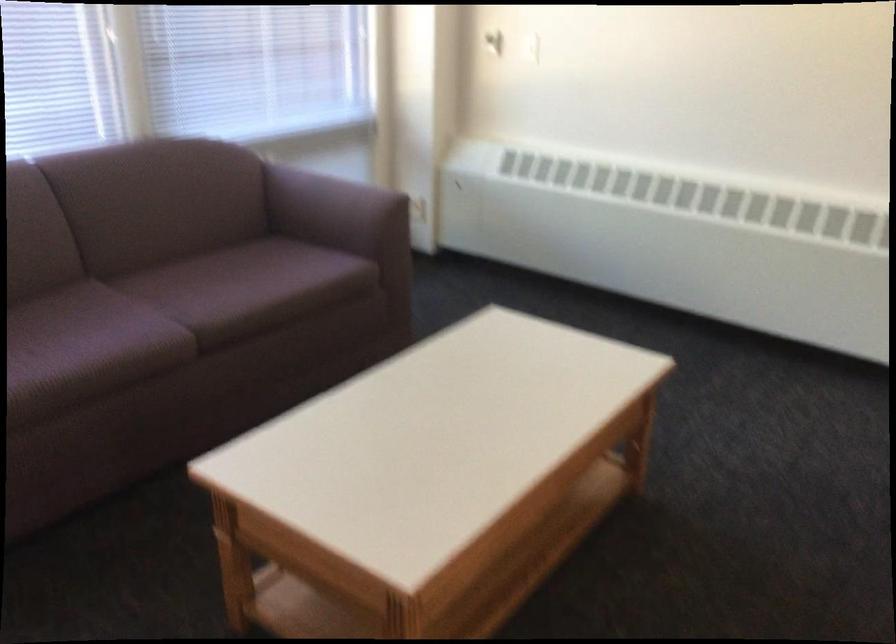
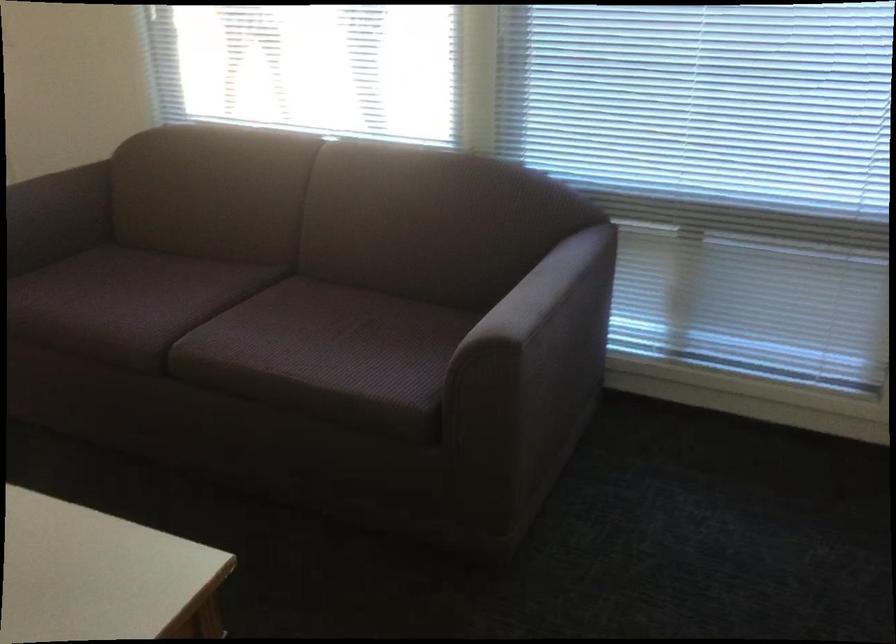
Find the pixel in the second image that matches the point at 348,184 in the first image.

(545, 294)